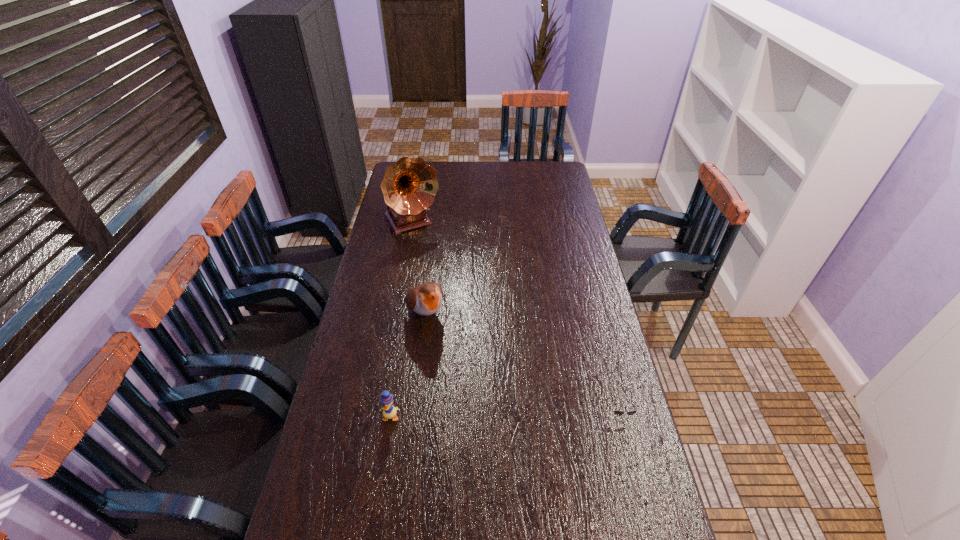
Find the location of a particular element. The width and height of the screenshot is (960, 540). vacant region at the left edge of the desktop is located at coordinates (387, 269).

Identify the location of free space at the right edge. The image size is (960, 540). 563,269.

In the image, there is a desktop. At what (x,y) coordinates should I click in order to perform the action: click on free space at the far right corner. Please return your answer as a coordinate pair (x, y). Looking at the image, I should click on (537, 175).

I want to click on vacant area that lies between the second shortest object and the phonograph_record, so click(401, 319).

Image resolution: width=960 pixels, height=540 pixels. I want to click on empty space between the rightmost object and the phonograph_record, so click(x=516, y=318).

Find the location of `free space between the rightmost object and the third shortest object`. free space between the rightmost object and the third shortest object is located at coordinates (522, 363).

Locate an element on the screen. The width and height of the screenshot is (960, 540). free spot between the rightmost object and the farthest object is located at coordinates (516, 318).

Find the location of a particular element. This screenshot has width=960, height=540. free spot between the third tallest object and the second tallest object is located at coordinates (408, 365).

Find the location of `empty space that is in between the farthest object and the third nearest object`. empty space that is in between the farthest object and the third nearest object is located at coordinates (419, 268).

Where is `blank region between the tallest object and the duckling`? blank region between the tallest object and the duckling is located at coordinates (401, 319).